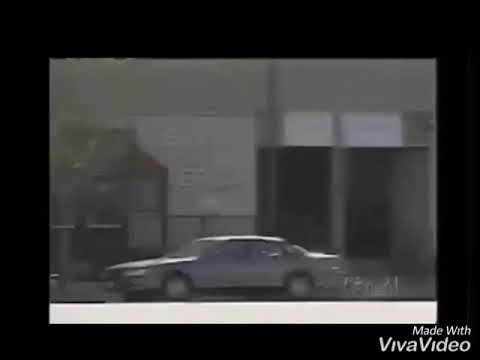
The height and width of the screenshot is (360, 480). I want to click on door, so click(228, 276), click(283, 275).